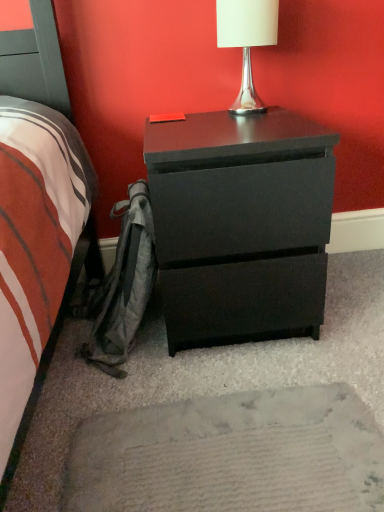
Question: Can we say matte black chest of drawers at center lies outside white glossy table lamp at upper center?

Choices:
 (A) no
 (B) yes

Answer: (B)

Question: Can you confirm if matte black chest of drawers at center is shorter than white glossy table lamp at upper center?

Choices:
 (A) yes
 (B) no

Answer: (B)

Question: Does matte black chest of drawers at center have a lesser width compared to white glossy table lamp at upper center?

Choices:
 (A) yes
 (B) no

Answer: (B)

Question: Could white glossy table lamp at upper center be considered to be inside matte black chest of drawers at center?

Choices:
 (A) yes
 (B) no

Answer: (B)

Question: From the image's perspective, would you say matte black chest of drawers at center is shown under white glossy table lamp at upper center?

Choices:
 (A) no
 (B) yes

Answer: (B)

Question: Is matte black chest of drawers at center positioned far away from white glossy table lamp at upper center?

Choices:
 (A) yes
 (B) no

Answer: (B)

Question: Is white glossy table lamp at upper center oriented towards matte black chest of drawers at center?

Choices:
 (A) yes
 (B) no

Answer: (B)

Question: Is white glossy table lamp at upper center next to matte black chest of drawers at center?

Choices:
 (A) no
 (B) yes

Answer: (A)

Question: Does white glossy table lamp at upper center have a greater width compared to matte black chest of drawers at center?

Choices:
 (A) no
 (B) yes

Answer: (A)

Question: Can you confirm if white glossy table lamp at upper center is positioned to the left of matte black chest of drawers at center?

Choices:
 (A) yes
 (B) no

Answer: (B)

Question: Is white glossy table lamp at upper center further to camera compared to matte black chest of drawers at center?

Choices:
 (A) yes
 (B) no

Answer: (A)

Question: Is matte black chest of drawers at center a part of white glossy table lamp at upper center?

Choices:
 (A) no
 (B) yes

Answer: (A)

Question: Is white glossy table lamp at upper center to the left or to the right of matte black chest of drawers at center in the image?

Choices:
 (A) left
 (B) right

Answer: (B)